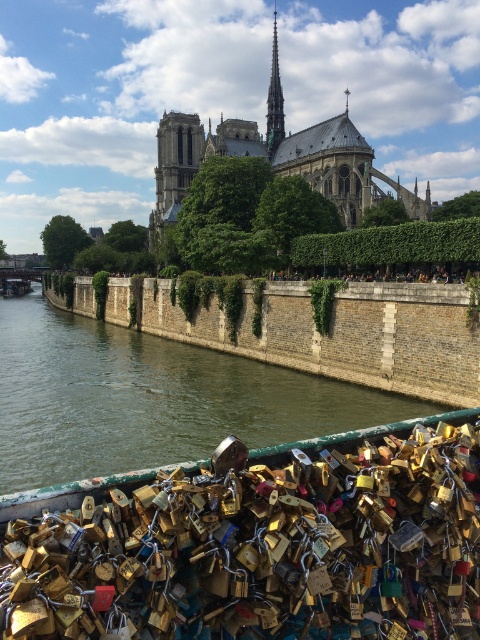
You are standing on the stone embankment and want to take a photo of the stone gothic cathedral at center. Which direction should you face to capture the cathedral in your view?

Since the stone gothic cathedral at center is located at point (343, 170), you should face towards the center of the image to capture it in your photo.

You are standing on the stone embankment near the Seine River and want to take a photo of the stone gothic cathedral at center. If your camera can focus on objects up to 100 meters away, will you need to move closer to get a clear shot?

The stone gothic cathedral at center is 112.32 meters away from the viewer, which exceeds the camera focus limit of 100 meters. Therefore, you need to move closer to ensure the cathedral is in focus.

You are a tourist standing on the stone embankment and want to take a photo of the gold metallic padlocks at center without the stone gothic cathedral at center blocking the view. Is this possible?

The gold metallic padlocks at center is behind the stone gothic cathedral at center, so it is blocked by the cathedral. Therefore, you cannot take a photo of the gold metallic padlocks at center without the cathedral blocking the view.